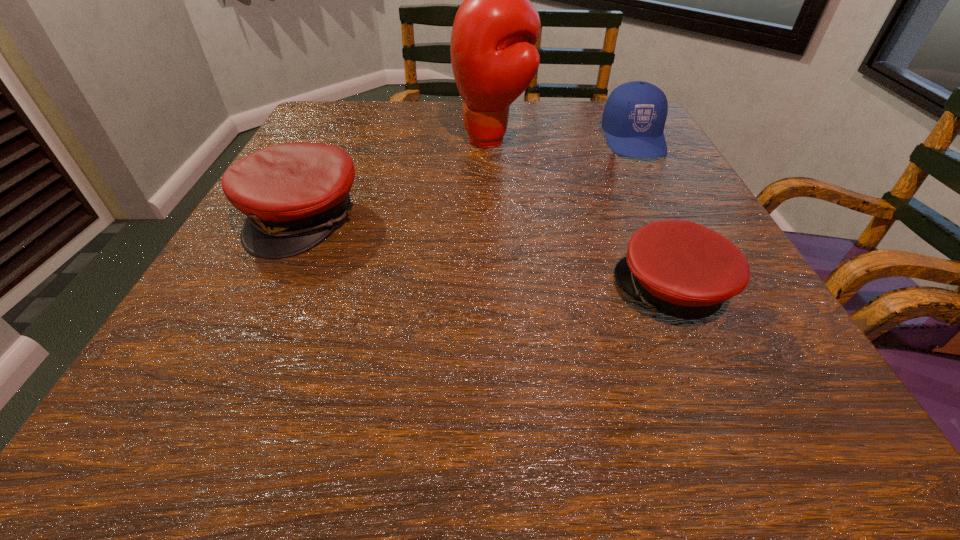
In the image, there is a desktop. At what (x,y) coordinates should I click in order to perform the action: click on vacant space at the right edge. Please return your answer as a coordinate pair (x, y). This screenshot has height=540, width=960. Looking at the image, I should click on (776, 381).

At what (x,y) coordinates should I click in order to perform the action: click on vacant space at the far left corner. Please return your answer as a coordinate pair (x, y). The height and width of the screenshot is (540, 960). Looking at the image, I should click on 328,129.

In the image, there is a desktop. Where is `free region at the near left corner`? free region at the near left corner is located at coordinates (232, 437).

This screenshot has width=960, height=540. Find the location of `free location at the near right corner of the desktop`. free location at the near right corner of the desktop is located at coordinates (816, 422).

Where is `unoccupied area between the leftmost cap and the tallest object`? unoccupied area between the leftmost cap and the tallest object is located at coordinates (398, 179).

You are a GUI agent. You are given a task and a screenshot of the screen. Output one action in this format:
    pyautogui.click(x=<x>, y=<y>)
    Task: Click on the unoccupied position between the leftmost object and the shortest object
    
    Given the screenshot: What is the action you would take?
    pyautogui.click(x=489, y=255)

Where is `vacant space that is in between the farthest cap and the leftmost cap`? Image resolution: width=960 pixels, height=540 pixels. vacant space that is in between the farthest cap and the leftmost cap is located at coordinates (468, 179).

Where is `free space between the shortest cap and the farthest cap`? free space between the shortest cap and the farthest cap is located at coordinates (653, 215).

I want to click on free area in between the boxing glove and the leftmost cap, so click(398, 179).

The width and height of the screenshot is (960, 540). In order to click on free space that is in between the farthest cap and the shortest cap in this screenshot , I will do pyautogui.click(x=653, y=215).